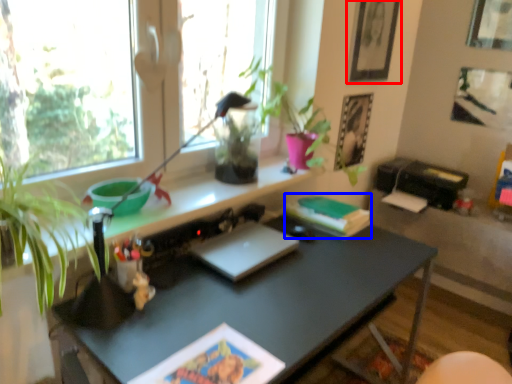
Question: Which of the following is the farthest to the observer, picture frame (highlighted by a red box) or paperback book (highlighted by a blue box)?

Choices:
 (A) picture frame
 (B) paperback book

Answer: (A)